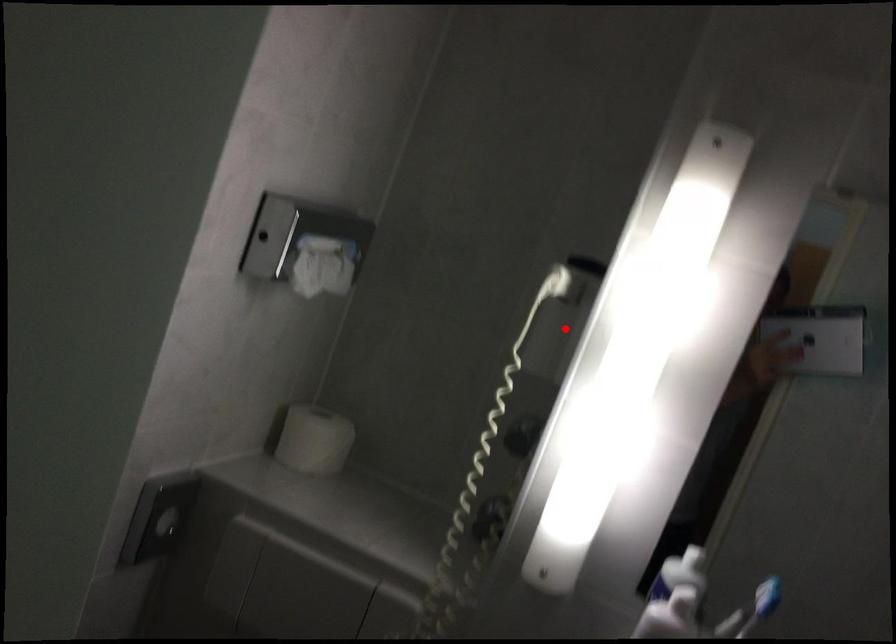
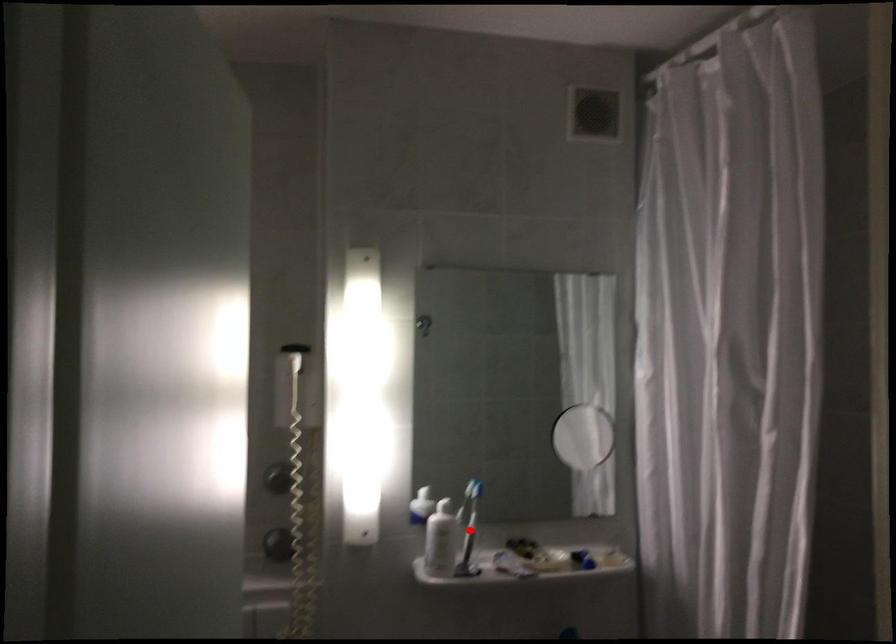
I am providing you with two images of the same scene from different viewpoints. A red point is marked on the first image and another point is marked on the second image. Is the red point in image1 aligned with the point shown in image2?

No